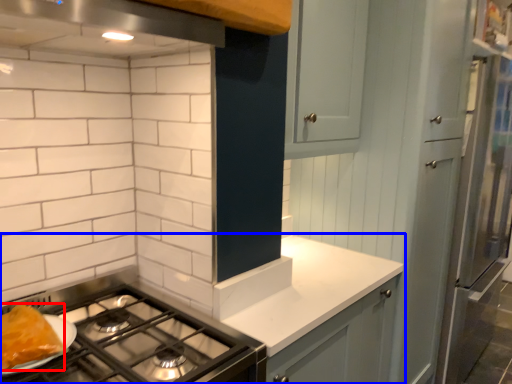
Question: Which point is closer to the camera, food (highlighted by a red box) or countertop (highlighted by a blue box)?

Choices:
 (A) food
 (B) countertop

Answer: (A)